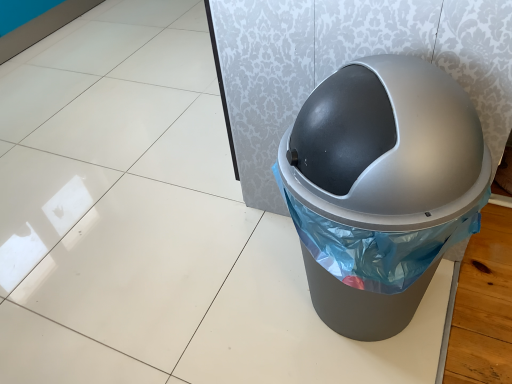
The width and height of the screenshot is (512, 384). What do you see at coordinates (381, 188) in the screenshot?
I see `satin silver trash can at center` at bounding box center [381, 188].

Image resolution: width=512 pixels, height=384 pixels. In order to click on satin silver trash can at center in this screenshot , I will do `click(381, 188)`.

Where is `satin silver trash can at center`? This screenshot has height=384, width=512. satin silver trash can at center is located at coordinates (381, 188).